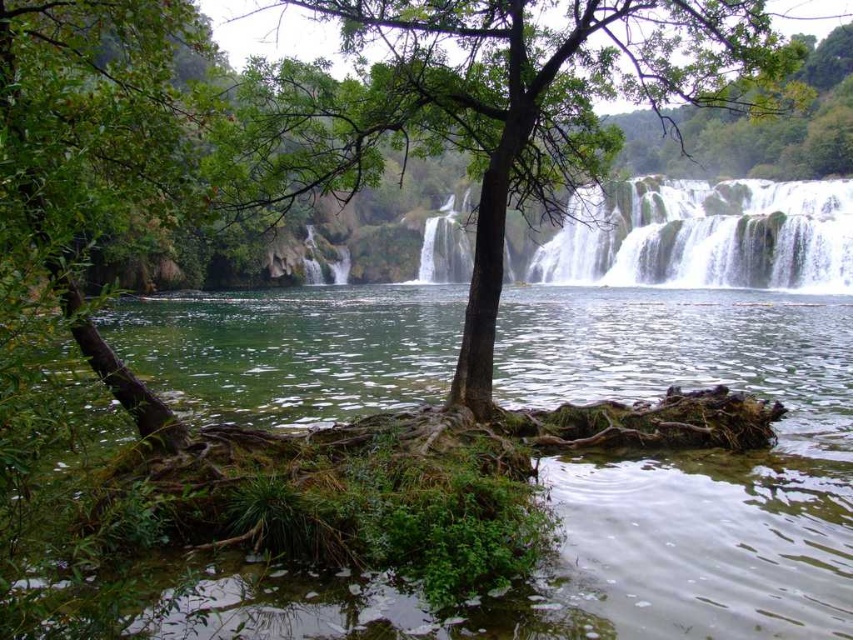
Question: Can you confirm if green leafy tree at center is positioned to the right of white frothy water at center?

Choices:
 (A) yes
 (B) no

Answer: (B)

Question: Is green mossy rock at center below green leafy tree at center?

Choices:
 (A) yes
 (B) no

Answer: (A)

Question: Among these points, which one is nearest to the camera?

Choices:
 (A) (712, 218)
 (B) (268, 627)
 (C) (248, 138)

Answer: (B)

Question: Which of these objects is positioned farthest from the white frothy water at center?

Choices:
 (A) green mossy rock at center
 (B) green leafy tree at center

Answer: (B)

Question: Which object is the farthest from the white frothy water at center?

Choices:
 (A) green leafy tree at center
 (B) green mossy rock at center

Answer: (A)

Question: Does green mossy rock at center have a greater width compared to white frothy water at center?

Choices:
 (A) yes
 (B) no

Answer: (A)